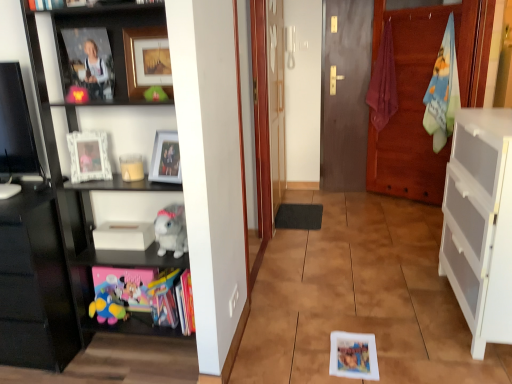
Image resolution: width=512 pixels, height=384 pixels. In order to click on free space to the back side of white matte cabinet at right, acting as the 2th cabinetry starting from the left in this screenshot , I will do `click(403, 258)`.